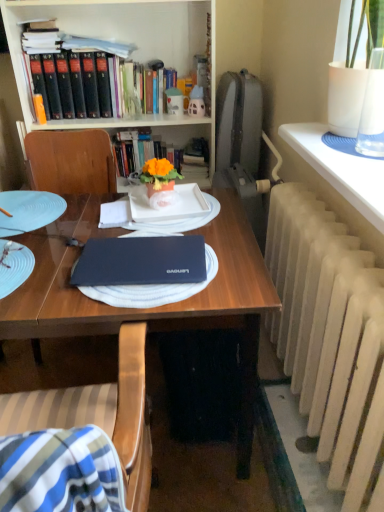
Where is `free space to the left of matte black laptop at center`? The width and height of the screenshot is (384, 512). free space to the left of matte black laptop at center is located at coordinates (43, 268).